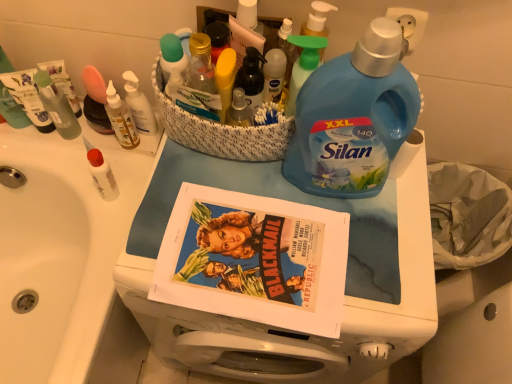
Question: Is translucent plastic bottle at center, which is counted as the 2th bottle, starting from the right, thinner than blue plastic laundry detergent at center?

Choices:
 (A) yes
 (B) no

Answer: (A)

Question: Considering the relative positions of translucent plastic bottle at center, which appears as the first bottle when viewed from the left, and blue plastic laundry detergent at center in the image provided, is translucent plastic bottle at center, which appears as the first bottle when viewed from the left, in front of blue plastic laundry detergent at center?

Choices:
 (A) no
 (B) yes

Answer: (A)

Question: Considering the relative sizes of translucent plastic bottle at center, which is counted as the 2th bottle, starting from the right, and blue plastic laundry detergent at center in the image provided, is translucent plastic bottle at center, which is counted as the 2th bottle, starting from the right, bigger than blue plastic laundry detergent at center?

Choices:
 (A) yes
 (B) no

Answer: (B)

Question: Considering the relative sizes of translucent plastic bottle at center, which appears as the first bottle when viewed from the left, and blue plastic laundry detergent at center in the image provided, is translucent plastic bottle at center, which appears as the first bottle when viewed from the left, wider than blue plastic laundry detergent at center?

Choices:
 (A) yes
 (B) no

Answer: (B)

Question: From a real-world perspective, is translucent plastic bottle at center, which appears as the first bottle when viewed from the left, over blue plastic laundry detergent at center?

Choices:
 (A) no
 (B) yes

Answer: (B)

Question: In the image, is translucent plastic bottle at upper center, placed as the first toiletry when sorted from right to left, positioned in front of or behind translucent plastic bottle at center, which is counted as the 2th bottle, starting from the right?

Choices:
 (A) front
 (B) behind

Answer: (A)

Question: Does point (208, 51) appear closer or farther from the camera than point (252, 69)?

Choices:
 (A) farther
 (B) closer

Answer: (B)

Question: From a real-world perspective, is translucent plastic bottle at upper center, the 4th toiletry viewed from the left, physically located above or below translucent plastic bottle at center, which is counted as the 2th bottle, starting from the right?

Choices:
 (A) below
 (B) above

Answer: (B)

Question: In terms of height, does translucent plastic bottle at upper center, the 4th toiletry viewed from the left, look taller or shorter compared to translucent plastic bottle at center, which appears as the first bottle when viewed from the left?

Choices:
 (A) tall
 (B) short

Answer: (B)

Question: From a real-world perspective, relative to blue plastic bottle at upper right, placed as the second bottle when sorted from left to right, is white plastic bottle at upper left, the third toiletry positioned from the left, vertically above or below?

Choices:
 (A) below
 (B) above

Answer: (A)

Question: From their relative heights in the image, would you say white plastic bottle at upper left, the third toiletry positioned from the left, is taller or shorter than blue plastic bottle at upper right, placed as the second bottle when sorted from left to right?

Choices:
 (A) tall
 (B) short

Answer: (B)

Question: In the image, is white plastic bottle at upper left, which ranks as the second toiletry in right-to-left order, positioned in front of or behind blue plastic bottle at upper right, placed as the first bottle when sorted from right to left?

Choices:
 (A) front
 (B) behind

Answer: (B)

Question: Does point (126, 97) appear closer or farther from the camera than point (397, 44)?

Choices:
 (A) closer
 (B) farther

Answer: (B)

Question: From the image's perspective, is matte paper comic book at center positioned above or below translucent plastic bottles at upper left, which is counted as the 3th toiletry, starting from the right?

Choices:
 (A) above
 (B) below

Answer: (B)

Question: Choose the correct answer: Is matte paper comic book at center inside translucent plastic bottles at upper left, which is counted as the 3th toiletry, starting from the right, or outside it?

Choices:
 (A) outside
 (B) inside

Answer: (A)